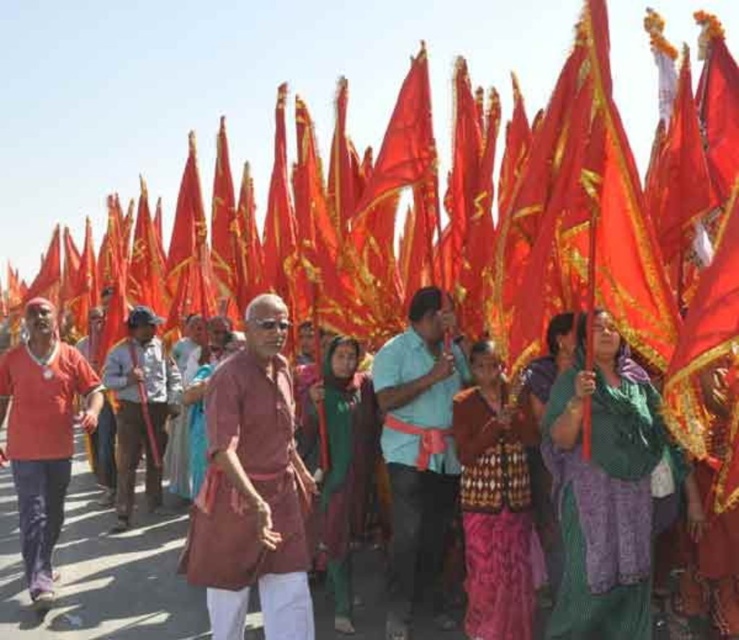
You are a photographer trying to capture a photo of the matte red shirt at left and the brown leather cap at center. Which object should you focus on first if you want to ensure both are in the frame without moving the camera?

The matte red shirt at left is below the brown leather cap at center, so you should focus on the brown leather cap at center first to ensure both are in the frame without moving the camera.

You are a photographer trying to capture the maroon fabric kurta at center and the patterned fabric sari at center in the same frame. Which clothing item is covering part of the other?

The maroon fabric kurta at center is positioned over the patterned fabric sari at center, so it is covering part of the sari.

You are a photographer trying to capture the maroon fabric kurta at center and the patterned fabric sari at center in the same frame. Which clothing item will appear larger in your photo?

The maroon fabric kurta at center will appear larger in the photo because it is bigger than the patterned fabric sari at center.